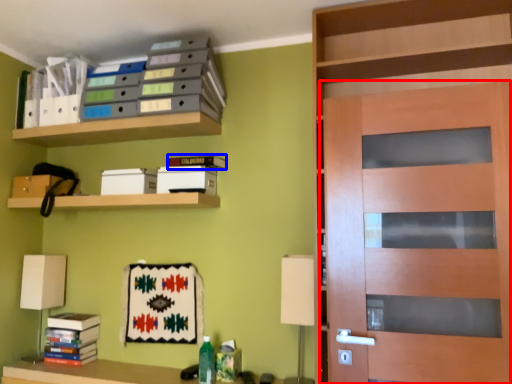
Question: Which object appears closest to the camera in this image, door (highlighted by a red box) or book (highlighted by a blue box)?

Choices:
 (A) door
 (B) book

Answer: (A)